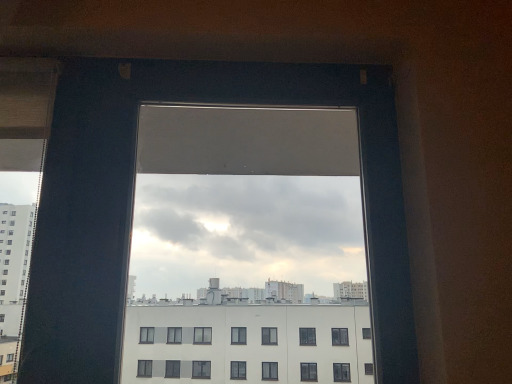
This screenshot has height=384, width=512. Describe the element at coordinates (247, 249) in the screenshot. I see `transparent plastic window screen at center` at that location.

Image resolution: width=512 pixels, height=384 pixels. In order to click on transparent plastic window screen at center in this screenshot , I will do `click(247, 249)`.

The height and width of the screenshot is (384, 512). I want to click on transparent plastic window screen at center, so coord(247,249).